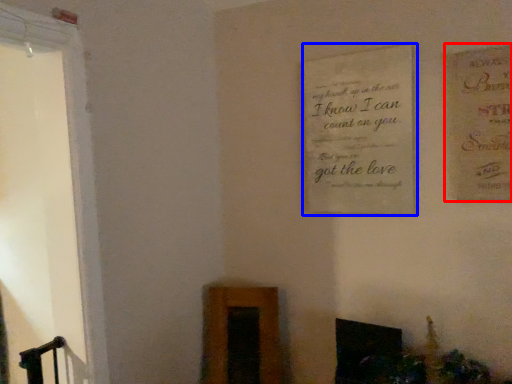
Question: Which object appears farthest to the camera in this image, postcard (highlighted by a red box) or plaque (highlighted by a blue box)?

Choices:
 (A) postcard
 (B) plaque

Answer: (B)